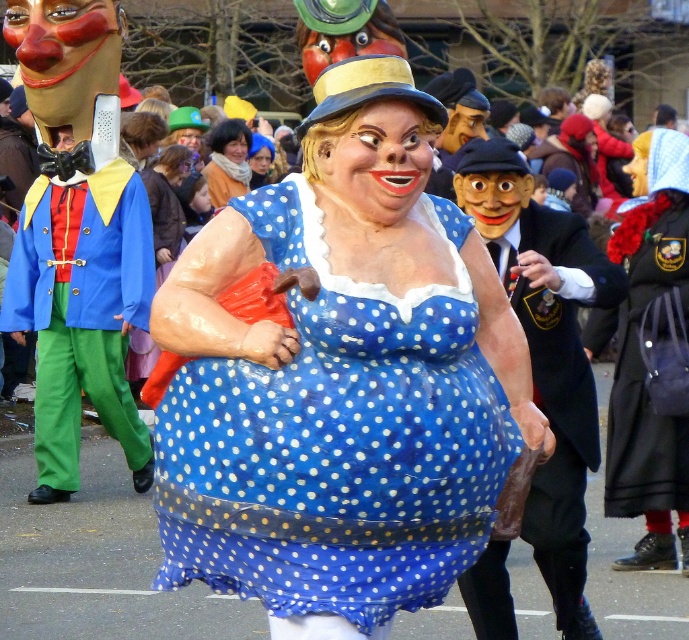
Question: Which of the following is the farthest from the observer?

Choices:
 (A) (212, 180)
 (B) (675, 340)
 (C) (163, 195)
 (D) (553, 480)

Answer: (A)

Question: In this image, where is blue polka dot fabric dress at center located relative to matte blue suit at left?

Choices:
 (A) right
 (B) left

Answer: (A)

Question: Considering the real-world distances, which object is farthest from the matte blue suit at left?

Choices:
 (A) blue polka dot dress at center
 (B) blue polka dot fabric dress at center
 (C) black woolen coat at center
 (D) matte black suit at center

Answer: (B)

Question: Is black woolen coat at center above blue polka dot dress at center?

Choices:
 (A) no
 (B) yes

Answer: (A)

Question: Among these points, which one is nearest to the camera?

Choices:
 (A) (657, 554)
 (B) (236, 189)

Answer: (A)

Question: Is matte black suit at center bigger than matte blue dress at center?

Choices:
 (A) no
 (B) yes

Answer: (B)